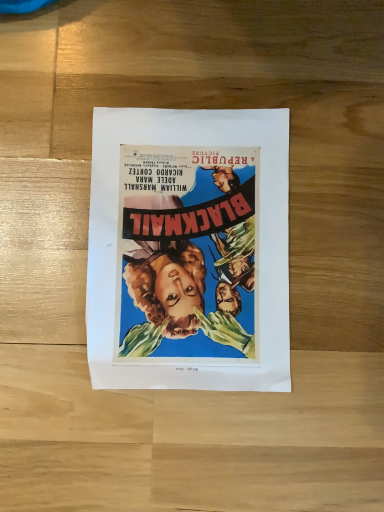
What do you see at coordinates (189, 250) in the screenshot? Image resolution: width=384 pixels, height=512 pixels. I see `matte paper poster at center` at bounding box center [189, 250].

You are a GUI agent. You are given a task and a screenshot of the screen. Output one action in this format:
    pyautogui.click(x=<x>, y=<y>)
    Task: Click on the matte paper poster at center
    
    Given the screenshot: What is the action you would take?
    pyautogui.click(x=189, y=250)

Where is `matte paper poster at center`? The height and width of the screenshot is (512, 384). matte paper poster at center is located at coordinates (189, 250).